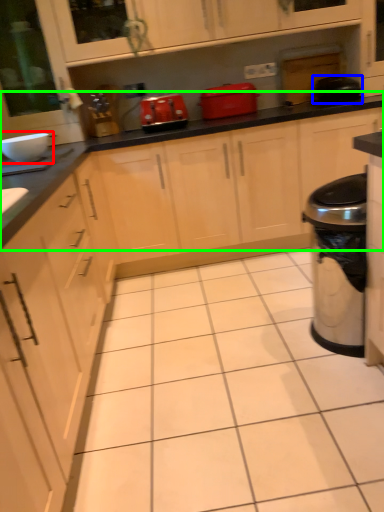
Question: Based on their relative distances, which object is farther from appliance (highlighted by a red box)? Choose from appliance (highlighted by a blue box) and countertop (highlighted by a green box).

Choices:
 (A) appliance
 (B) countertop

Answer: (A)